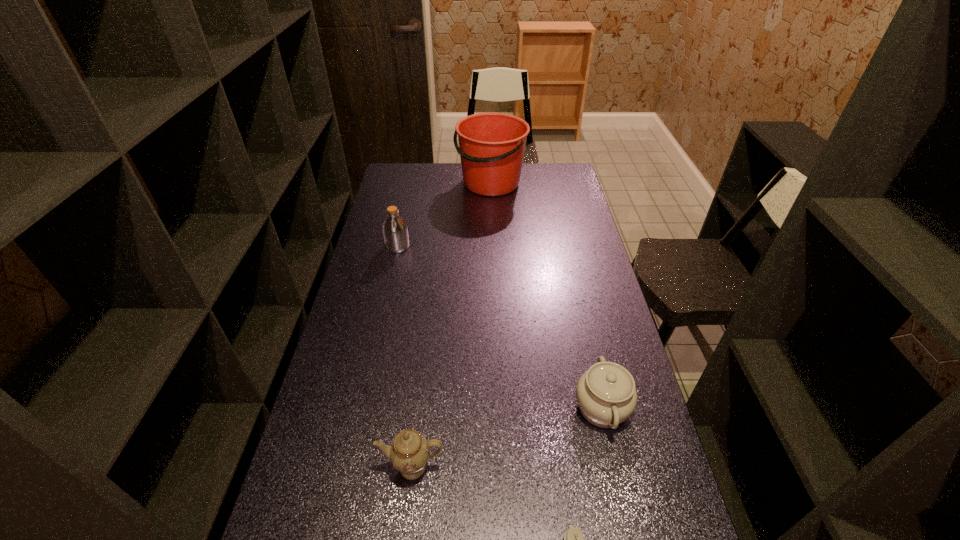
This screenshot has height=540, width=960. I want to click on bucket, so click(491, 145).

Locate an element on the screen. This screenshot has width=960, height=540. the farthest object is located at coordinates (491, 145).

You are a GUI agent. You are given a task and a screenshot of the screen. Output one action in this format:
    pyautogui.click(x=<x>, y=<y>)
    Task: Click on the leftmost object
    This screenshot has width=960, height=540.
    Given the screenshot: What is the action you would take?
    pyautogui.click(x=395, y=231)

Locate an element on the screen. This screenshot has height=540, width=960. the second farthest object is located at coordinates (395, 231).

Locate an element on the screen. This screenshot has height=540, width=960. the nearer chinaware is located at coordinates (409, 453).

Identify the location of the second nearest object. The image size is (960, 540). (409, 453).

At what (x,y) coordinates should I click in order to perform the action: click on the rightmost object. Please return your answer as a coordinate pair (x, y). Looking at the image, I should click on pos(606,395).

Where is `the farther chinaware`? the farther chinaware is located at coordinates (606, 395).

The width and height of the screenshot is (960, 540). In order to click on vacant region located 0.110m on the right of the farthest object in this screenshot , I will do `click(549, 183)`.

The height and width of the screenshot is (540, 960). Identify the location of vacant space located on the back of the bottle. (403, 224).